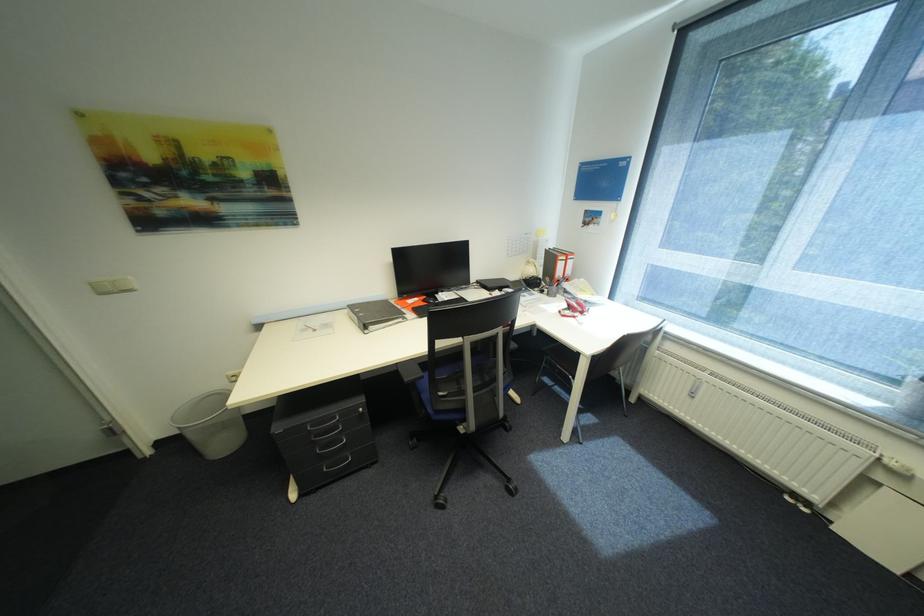
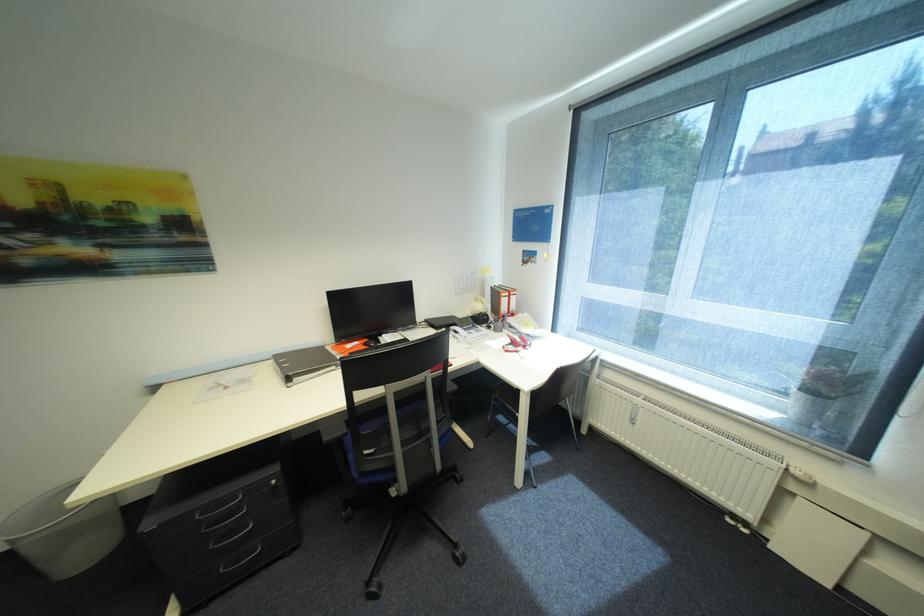
The point at (x=325, y=452) is marked in the first image. Where is the corresponding point in the second image?

(219, 546)